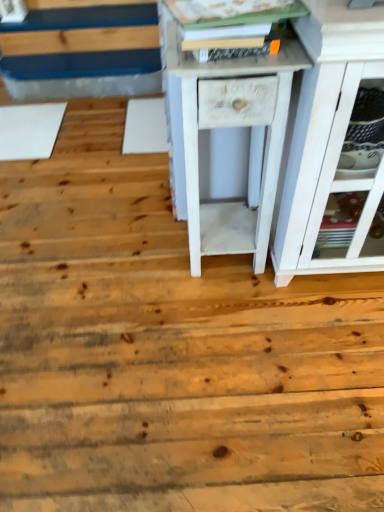
Question: From a real-world perspective, is white painted wood cabinet at right on white matte nightstand at center?

Choices:
 (A) no
 (B) yes

Answer: (B)

Question: Is white painted wood cabinet at right facing away from white matte nightstand at center?

Choices:
 (A) yes
 (B) no

Answer: (B)

Question: From a real-world perspective, is white painted wood cabinet at right under white matte nightstand at center?

Choices:
 (A) yes
 (B) no

Answer: (B)

Question: Is white painted wood cabinet at right wider than white matte nightstand at center?

Choices:
 (A) no
 (B) yes

Answer: (B)

Question: Is white painted wood cabinet at right at the right side of white matte nightstand at center?

Choices:
 (A) no
 (B) yes

Answer: (B)

Question: Is white painted wood cabinet at right at the left side of white matte nightstand at center?

Choices:
 (A) no
 (B) yes

Answer: (A)

Question: Can you confirm if white matte nightstand at center is shorter than white painted wood cabinet at right?

Choices:
 (A) no
 (B) yes

Answer: (B)

Question: Considering the relative sizes of white matte nightstand at center and white painted wood cabinet at right in the image provided, is white matte nightstand at center bigger than white painted wood cabinet at right?

Choices:
 (A) no
 (B) yes

Answer: (A)

Question: From the image's perspective, is white matte nightstand at center located beneath white painted wood cabinet at right?

Choices:
 (A) no
 (B) yes

Answer: (B)

Question: Considering the relative positions of white matte nightstand at center and white painted wood cabinet at right in the image provided, is white matte nightstand at center behind white painted wood cabinet at right?

Choices:
 (A) no
 (B) yes

Answer: (B)

Question: Considering the relative positions of white matte nightstand at center and white painted wood cabinet at right in the image provided, is white matte nightstand at center to the left of white painted wood cabinet at right from the viewer's perspective?

Choices:
 (A) yes
 (B) no

Answer: (A)

Question: Can you confirm if white matte nightstand at center is wider than white painted wood cabinet at right?

Choices:
 (A) no
 (B) yes

Answer: (A)

Question: Considering their positions, is white painted wood cabinet at right located in front of or behind white matte nightstand at center?

Choices:
 (A) behind
 (B) front

Answer: (B)